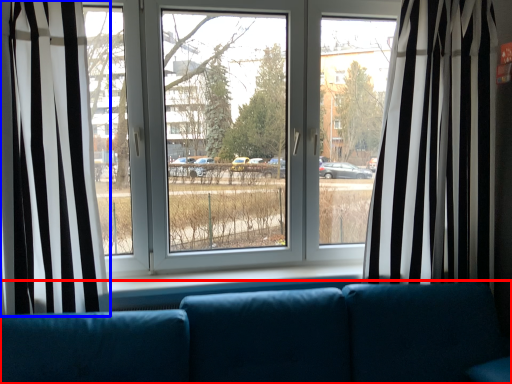
Question: Among these objects, which one is farthest to the camera, studio couch (highlighted by a red box) or curtain (highlighted by a blue box)?

Choices:
 (A) studio couch
 (B) curtain

Answer: (B)